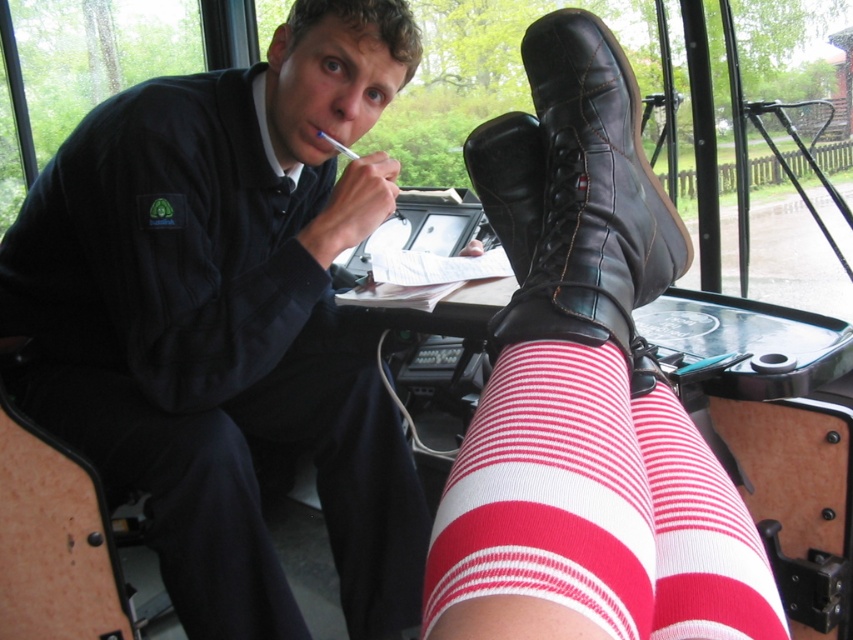
Does matte black shirt at center lie in front of leather boots at center?

No, matte black shirt at center is behind leather boots at center.

Find the location of a particular element. The image size is (853, 640). matte black shirt at center is located at coordinates (228, 317).

Find the location of a particular element. The height and width of the screenshot is (640, 853). matte black shirt at center is located at coordinates (228, 317).

Is red striped sock at lower center wider than leather boots at center?

No, red striped sock at lower center is not wider than leather boots at center.

Identify the location of red striped sock at lower center. This screenshot has width=853, height=640. (549, 496).

Locate an element on the screen. The height and width of the screenshot is (640, 853). red striped tights at lower right is located at coordinates (257, 483).

Is point (267, 380) behind point (697, 620)?

That is True.

Is point (231, 499) closer to viewer compared to point (659, 621)?

That is False.

Where is `red striped tights at lower right`? red striped tights at lower right is located at coordinates (257, 483).